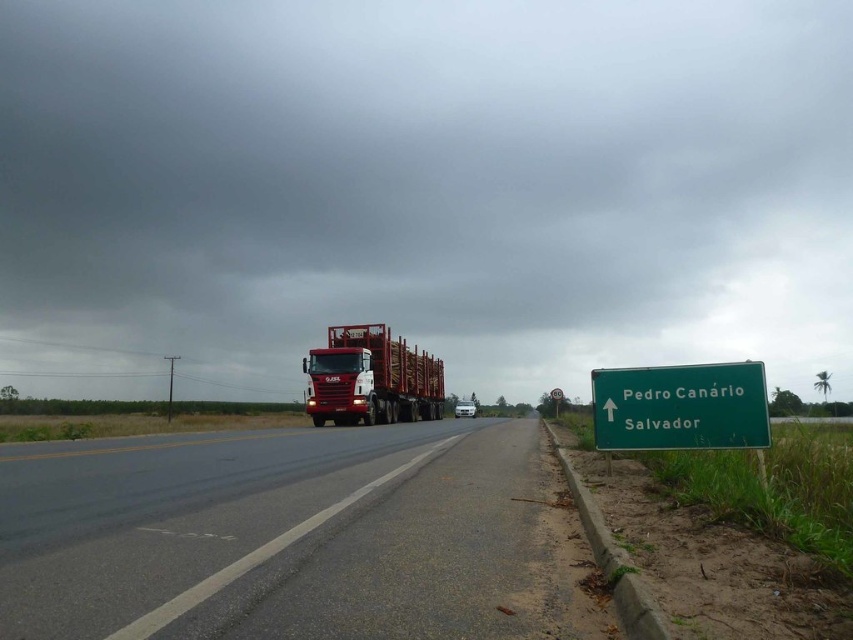
You are a driver planning to overtake the metallic red trailer truck at center on the black asphalt road at center. Considering the road size, can you safely pass the truck without going off the road?

The black asphalt road at center has a smaller size compared to metallic red trailer truck at center, so overtaking might be dangerous as the road may not provide enough space to safely maneuver around the truck.

You are a delivery driver planning to drive along the rural road shown. You notice the dark gray cloud at upper center. Based on its position, which direction should you expect rain to come from?

The dark gray cloud at upper center is located at point (422, 189), so the rain is likely coming from the upper direction relative to the scene, which would be from the direction of the cloud above the road.

You are a driver approaching the black asphalt road at center and notice the dark gray cloud at upper center. Based on their positions, which direction should you turn your headlights to better illuminate the road ahead?

You should turn your headlights to the left because the dark gray cloud at upper center is located to the left of the black asphalt road at center, indicating that the road ahead curves leftward under the cloud cover, requiring better illumination in that direction.